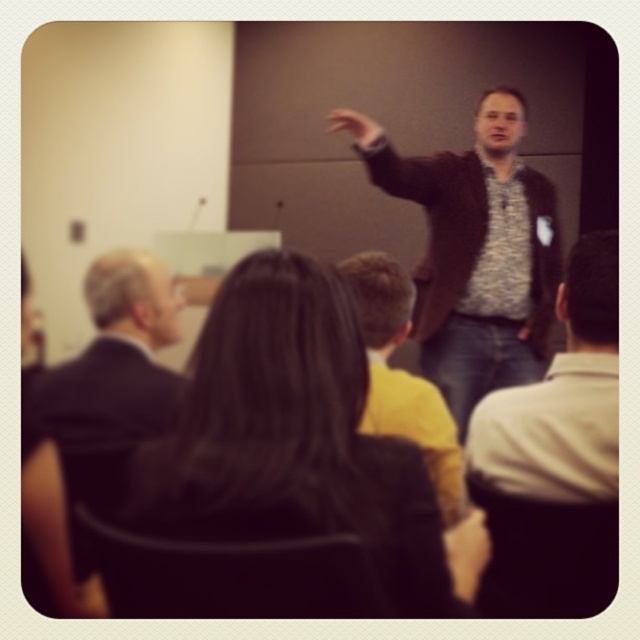
Question: Considering the relative positions of patterned fabric shirt at center and black suit at left in the image provided, where is patterned fabric shirt at center located with respect to black suit at left?

Choices:
 (A) below
 (B) above

Answer: (B)

Question: Which object is the closest to the dark brown leather jacket at center?

Choices:
 (A) black suit at left
 (B) yellow shirt at center

Answer: (B)

Question: Does dark brown leather jacket at center lie behind black suit at left?

Choices:
 (A) yes
 (B) no

Answer: (A)

Question: Which point is closer to the camera?

Choices:
 (A) (496, 416)
 (B) (456, 160)

Answer: (A)

Question: Which of the following is the farthest from the observer?

Choices:
 (A) (605, 320)
 (B) (177, 323)

Answer: (B)

Question: Does dark brown leather jacket at center appear under patterned fabric shirt at center?

Choices:
 (A) yes
 (B) no

Answer: (B)